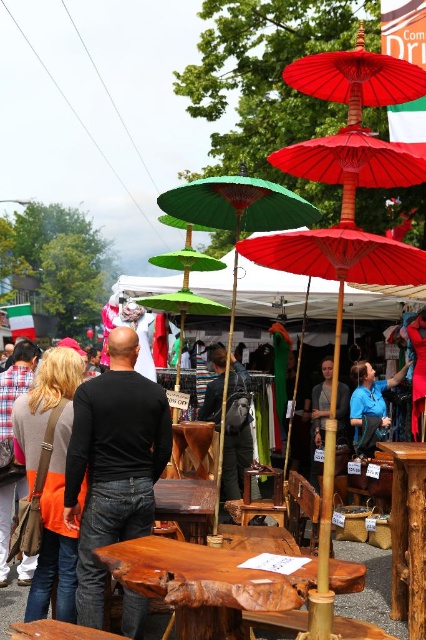
Question: Is orange fabric at left closer to the viewer compared to blue fabric at center?

Choices:
 (A) yes
 (B) no

Answer: (A)

Question: Estimate the real-world distances between objects in this image. Which object is farther from the black fabric dress at center?

Choices:
 (A) blue fabric at center
 (B) orange fabric at left
 (C) natural wood table at center

Answer: (B)

Question: Is natural wood picnic table at center further to the viewer compared to orange fabric at left?

Choices:
 (A) yes
 (B) no

Answer: (B)

Question: Does orange fabric bag at lower left have a smaller size compared to blue fabric at center?

Choices:
 (A) yes
 (B) no

Answer: (B)

Question: Which object appears farthest from the camera in this image?

Choices:
 (A) natural wood table at center
 (B) blue fabric at center

Answer: (B)

Question: Which object is farther from the camera taking this photo?

Choices:
 (A) black fabric dress at center
 (B) dark gray fabric bag at center
 (C) orange fabric at left

Answer: (A)